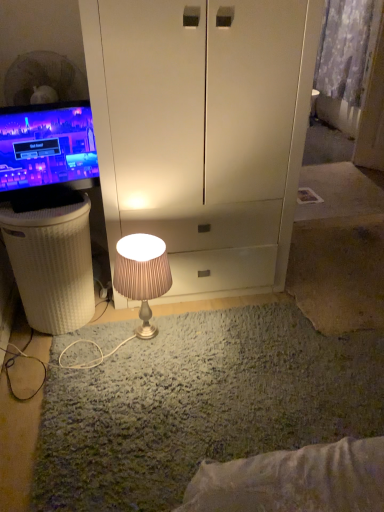
Describe the element at coordinates (46, 154) in the screenshot. I see `matte black monitor at left` at that location.

This screenshot has height=512, width=384. Describe the element at coordinates (52, 265) in the screenshot. I see `white wicker basket at left` at that location.

Find the location of a particular element. The width and height of the screenshot is (384, 512). satin beige lamp at center is located at coordinates (142, 274).

Which is farther from the camera, (147, 300) or (75, 118)?

The point (147, 300) is farther from the camera.

How many degrees apart are the facing directions of satin beige lamp at center and matte black monitor at left?

→ They differ by 17.8 degrees in their facing directions.

Measure the distance between satin beige lamp at center and matte black monitor at left.

satin beige lamp at center is 18.30 inches from matte black monitor at left.

Considering the sizes of satin beige lamp at center and matte black monitor at left in the image, is satin beige lamp at center bigger or smaller than matte black monitor at left?

Clearly, satin beige lamp at center is larger in size than matte black monitor at left.

From the image's perspective, would you say matte black monitor at left is positioned over white wicker basket at left?

Yes.

Is matte black monitor at left inside the boundaries of white wicker basket at left, or outside?

The correct answer is: outside.

Is there a large distance between matte black monitor at left and white wicker basket at left?

That's not correct — matte black monitor at left is a little close to white wicker basket at left.

This screenshot has width=384, height=512. Find the location of `vanity behind the matte black monitor at left`. vanity behind the matte black monitor at left is located at coordinates (52, 265).

From a real-world perspective, which is physically below, satin beige lamp at center or white wicker basket at left?

satin beige lamp at center, from a real-world perspective.

What's the angular difference between satin beige lamp at center and white wicker basket at left's facing directions?

0.742 degrees.

Is satin beige lamp at center looking in the opposite direction of white wicker basket at left?

No.

Which object is positioned more to the right, satin beige lamp at center or white wicker basket at left?

satin beige lamp at center is more to the right.

From a real-world perspective, which object rests below the other?

matte black monitor at left, from a real-world perspective.

Are patterned fabric curtain at upper right and matte black monitor at left located far from each other?

Indeed, patterned fabric curtain at upper right is not near matte black monitor at left.

Looking at this image, does patterned fabric curtain at upper right have a greater width compared to matte black monitor at left?

Indeed, patterned fabric curtain at upper right has a greater width compared to matte black monitor at left.

Is patterned fabric curtain at upper right inside satin beige lamp at center?

That's incorrect, patterned fabric curtain at upper right is not inside satin beige lamp at center.

Can you confirm if satin beige lamp at center is wider than patterned fabric curtain at upper right?

Correct, the width of satin beige lamp at center exceeds that of patterned fabric curtain at upper right.

From the image's perspective, is satin beige lamp at center on top of patterned fabric curtain at upper right?

No, from the image's perspective, satin beige lamp at center is not above patterned fabric curtain at upper right.

Can you tell me how much satin beige lamp at center and patterned fabric curtain at upper right differ in facing direction?

84.5 degrees.

Considering their positions, is white wicker basket at left located in front of or behind satin beige lamp at center?

Visually, white wicker basket at left is located behind satin beige lamp at center.

From a real-world perspective, which object rests below the other?

From a 3D spatial view, satin beige lamp at center is below.

Considering the sizes of objects white wicker basket at left and satin beige lamp at center in the image provided, who is smaller, white wicker basket at left or satin beige lamp at center?

Smaller between the two is satin beige lamp at center.

Who is taller, white wicker basket at left or satin beige lamp at center?

With more height is white wicker basket at left.

I want to click on lamp below the matte black monitor at left (from the image's perspective), so click(142, 274).

Which object is closer to the camera taking this photo, matte black monitor at left or satin beige lamp at center?

Positioned in front is matte black monitor at left.

Considering the sizes of matte black monitor at left and satin beige lamp at center in the image, is matte black monitor at left bigger or smaller than satin beige lamp at center?

In the image, matte black monitor at left appears to be smaller than satin beige lamp at center.

The width and height of the screenshot is (384, 512). Find the location of `television in front of the satin beige lamp at center`. television in front of the satin beige lamp at center is located at coordinates pyautogui.click(x=46, y=154).

Identify the location of vanity behind the matte black monitor at left. This screenshot has width=384, height=512. (52, 265).

Estimate the real-world distances between objects in this image. Which object is further from patterned fabric curtain at upper right, white wicker basket at left or satin beige lamp at center?

white wicker basket at left is positioned further to the anchor patterned fabric curtain at upper right.

Considering their positions, is satin beige lamp at center positioned further to matte black monitor at left than patterned fabric curtain at upper right?

Among the two, patterned fabric curtain at upper right is located further to matte black monitor at left.

Which object lies nearer to the anchor point matte black monitor at left, patterned fabric curtain at upper right or satin beige lamp at center?

Among the two, satin beige lamp at center is located nearer to matte black monitor at left.

Based on their spatial positions, is satin beige lamp at center or matte black monitor at left closer to patterned fabric curtain at upper right?

matte black monitor at left.

When comparing their distances from patterned fabric curtain at upper right, does matte black monitor at left or satin beige lamp at center seem closer?

matte black monitor at left is closer to patterned fabric curtain at upper right.

When comparing their distances from patterned fabric curtain at upper right, does matte black monitor at left or white wicker basket at left seem closer?

matte black monitor at left is positioned closer to the anchor patterned fabric curtain at upper right.

Based on their spatial positions, is patterned fabric curtain at upper right or matte black monitor at left further from white wicker basket at left?

Among the two, patterned fabric curtain at upper right is located further to white wicker basket at left.

Estimate the real-world distances between objects in this image. Which object is further from satin beige lamp at center, patterned fabric curtain at upper right or matte black monitor at left?

patterned fabric curtain at upper right is positioned further to the anchor satin beige lamp at center.

Where is `vanity positioned between matte black monitor at left and patterned fabric curtain at upper right from near to far`? Image resolution: width=384 pixels, height=512 pixels. vanity positioned between matte black monitor at left and patterned fabric curtain at upper right from near to far is located at coordinates (52, 265).

What are the coordinates of `vanity between matte black monitor at left and satin beige lamp at center in the up-down direction` in the screenshot? It's located at (52, 265).

This screenshot has width=384, height=512. Find the location of `lamp between matte black monitor at left and patterned fabric curtain at upper right in the front-back direction`. lamp between matte black monitor at left and patterned fabric curtain at upper right in the front-back direction is located at coordinates (142, 274).

The width and height of the screenshot is (384, 512). I want to click on vanity positioned between satin beige lamp at center and patterned fabric curtain at upper right from near to far, so click(52, 265).